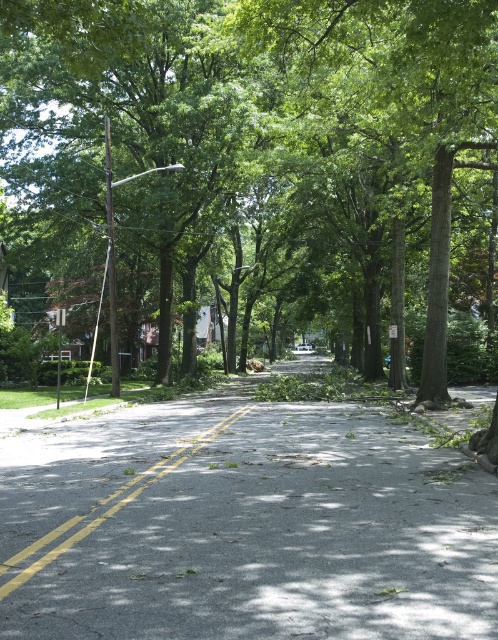
Question: Which point is farther from the camera taking this photo?

Choices:
 (A) (297, 76)
 (B) (215, 627)

Answer: (A)

Question: Estimate the real-world distances between objects in this image. Which object is closer to the yellow asphalt road at center?

Choices:
 (A) green leafy tree at center
 (B) dark gray asphalt road at center

Answer: (B)

Question: Is green leafy tree at center smaller than yellow asphalt road at center?

Choices:
 (A) no
 (B) yes

Answer: (A)

Question: In this image, where is dark gray asphalt road at center located relative to yellow asphalt road at center?

Choices:
 (A) below
 (B) above

Answer: (A)

Question: Is green leafy tree at center above yellow asphalt road at center?

Choices:
 (A) yes
 (B) no

Answer: (A)

Question: Which point is farther to the camera?

Choices:
 (A) green leafy tree at center
 (B) dark gray asphalt road at center

Answer: (A)